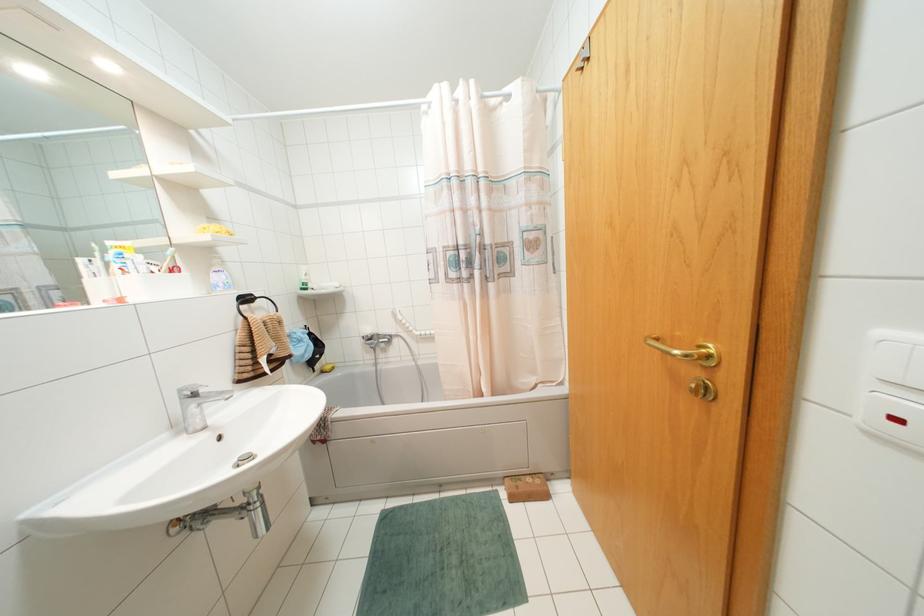
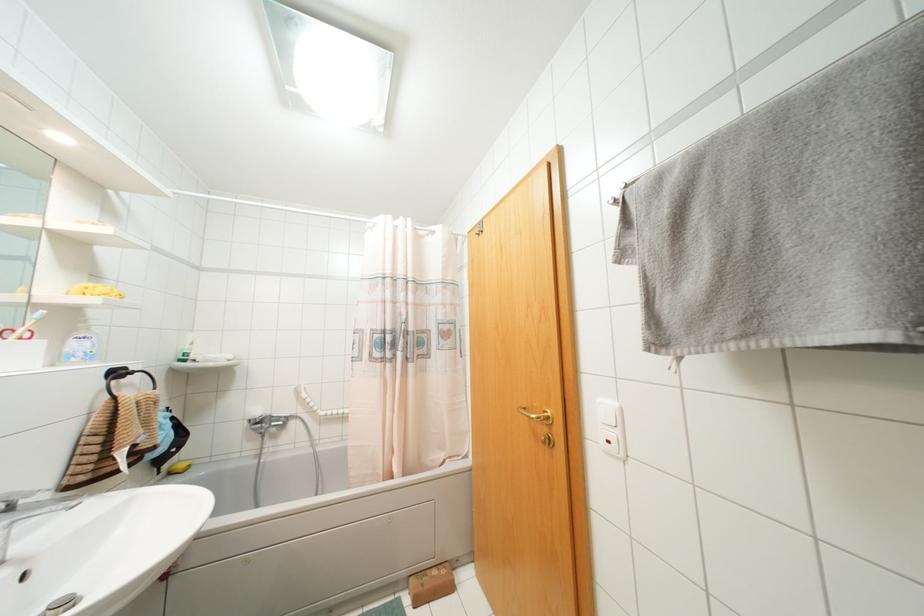
Where in the second image is the point corresponding to point (171, 249) from the first image?

(42, 310)